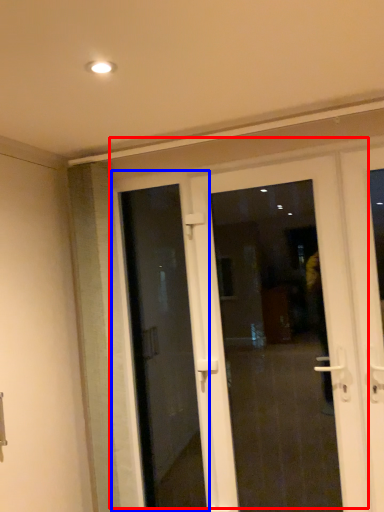
Question: Which point is further to the camera, door (highlighted by a red box) or door (highlighted by a blue box)?

Choices:
 (A) door
 (B) door

Answer: (B)